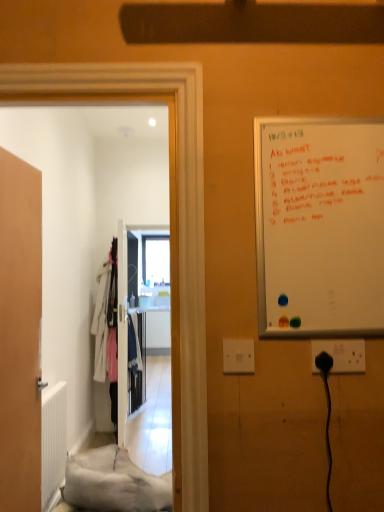
Question: From a real-world perspective, does white carpet at lower left stand above black plastic socket at lower right, the second electric outlet from the left?

Choices:
 (A) no
 (B) yes

Answer: (A)

Question: Can you confirm if white carpet at lower left is thinner than black plastic socket at lower right, the 1th electric outlet positioned from the right?

Choices:
 (A) yes
 (B) no

Answer: (B)

Question: Is white carpet at lower left facing away from black plastic socket at lower right, the 1th electric outlet positioned from the right?

Choices:
 (A) yes
 (B) no

Answer: (B)

Question: Does white carpet at lower left have a greater height compared to black plastic socket at lower right, the second electric outlet from the left?

Choices:
 (A) yes
 (B) no

Answer: (A)

Question: Does white carpet at lower left appear on the right side of black plastic socket at lower right, the 1th electric outlet positioned from the right?

Choices:
 (A) no
 (B) yes

Answer: (A)

Question: Could you tell me if white carpet at lower left is turned towards black plastic socket at lower right, the 1th electric outlet positioned from the right?

Choices:
 (A) no
 (B) yes

Answer: (A)

Question: Can you confirm if black plastic socket at lower right, the second electric outlet from the left, is shorter than wooden door at left?

Choices:
 (A) yes
 (B) no

Answer: (A)

Question: Is black plastic socket at lower right, the second electric outlet from the left, located outside wooden door at left?

Choices:
 (A) yes
 (B) no

Answer: (A)

Question: Is black plastic socket at lower right, the 1th electric outlet positioned from the right, at the right side of wooden door at left?

Choices:
 (A) no
 (B) yes

Answer: (B)

Question: Would you consider black plastic socket at lower right, the second electric outlet from the left, to be distant from wooden door at left?

Choices:
 (A) no
 (B) yes

Answer: (B)

Question: Is wooden door at left a part of black plastic socket at lower right, the second electric outlet from the left?

Choices:
 (A) no
 (B) yes

Answer: (A)

Question: Considering the relative sizes of black plastic socket at lower right, the second electric outlet from the left, and wooden door at left in the image provided, is black plastic socket at lower right, the second electric outlet from the left, bigger than wooden door at left?

Choices:
 (A) yes
 (B) no

Answer: (B)

Question: Is whiteboard at right shorter than black plastic socket at lower right, the second electric outlet from the left?

Choices:
 (A) no
 (B) yes

Answer: (A)